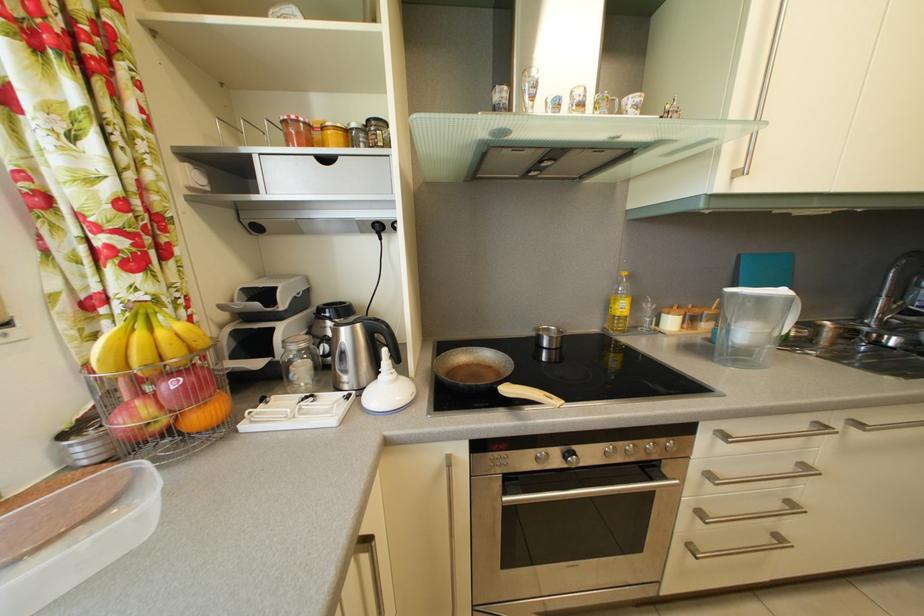
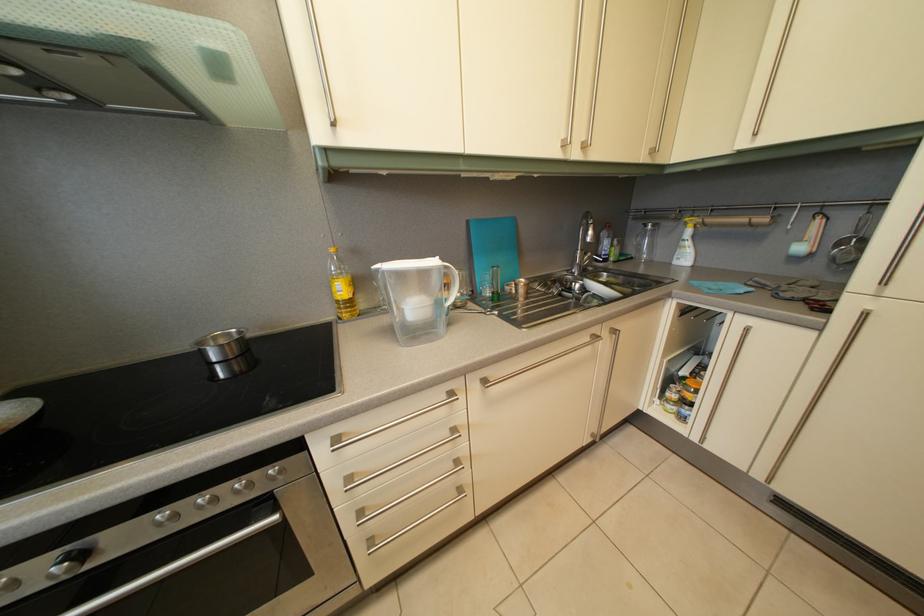
Question: What movement of the cameraman would produce the second image?

Choices:
 (A) Left
 (B) Right
 (C) Forward
 (D) Backward

Answer: (B)